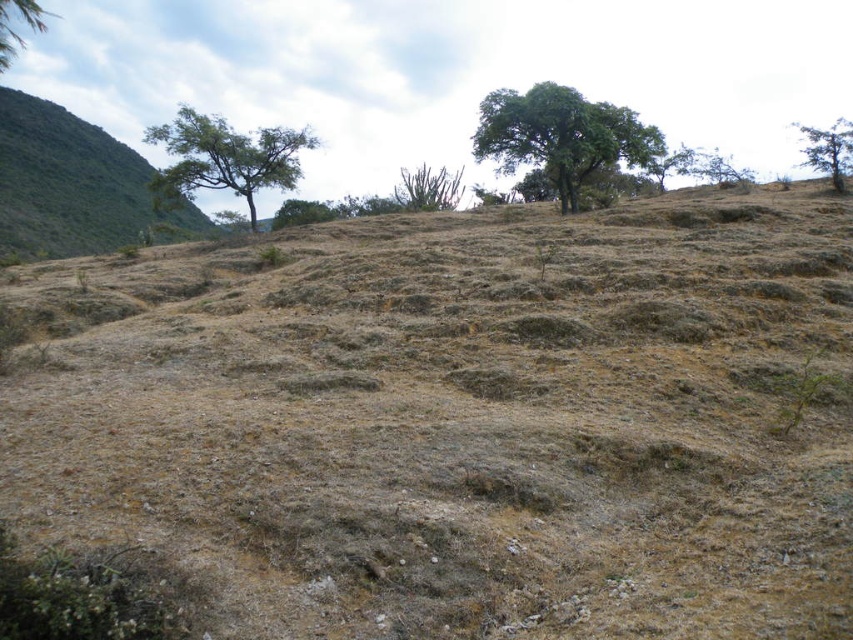
Question: Is green leafy hillside at left wider than green leafy tree at upper center?

Choices:
 (A) yes
 (B) no

Answer: (A)

Question: Which of these objects is positioned farthest from the green leafy tree at upper left?

Choices:
 (A) green leafy hillside at left
 (B) green leafy tree at left
 (C) dried soil at center
 (D) green leafy tree at upper right

Answer: (D)

Question: Is green leafy tree at left bigger than green leafy tree at upper left?

Choices:
 (A) no
 (B) yes

Answer: (A)

Question: Which point is farther to the camera?

Choices:
 (A) dried soil at center
 (B) green leafy tree at left
 (C) green leafy tree at upper right
 (D) green leafy tree at upper left

Answer: (B)

Question: Can you confirm if dried soil at center is positioned to the right of green leafy tree at upper center?

Choices:
 (A) yes
 (B) no

Answer: (B)

Question: Considering the real-world distances, which object is farthest from the dried soil at center?

Choices:
 (A) green leafy tree at upper right
 (B) green leafy tree at upper center
 (C) green leafy tree at left
 (D) green leafy tree at upper left

Answer: (A)